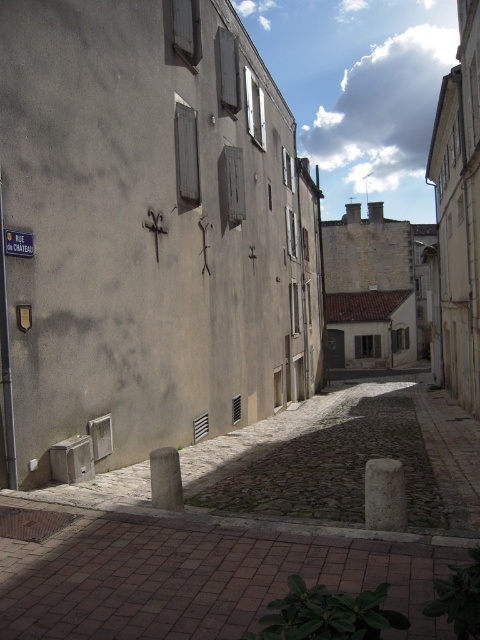
You are a delivery person trying to locate the address on the blue plastic street sign at upper left. You see the wooden textured shutter at center in your way. Is the shutter blocking your view of the street sign?

The wooden textured shutter at center is above the blue plastic street sign at upper left, so the shutter is blocking the view of the street sign.

You are a delivery person trying to navigate through the narrow cobblestone street. You see the brick pavement at lower center and the blue plastic street sign at upper left. Which object is closer to you as you stand at the entrance of the street?

The brick pavement at lower center is closer to you than the blue plastic street sign at upper left because it is in front of it.